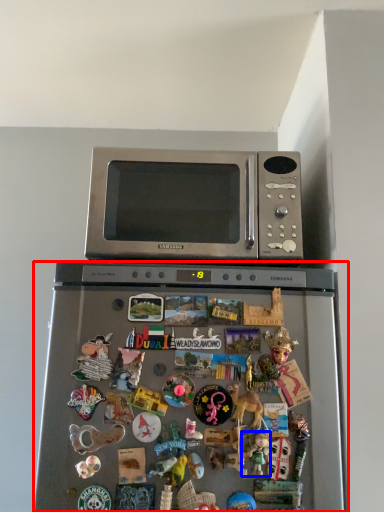
Question: Which point is further to the camera, refrigerator (highlighted by a red box) or toy (highlighted by a blue box)?

Choices:
 (A) refrigerator
 (B) toy

Answer: (B)